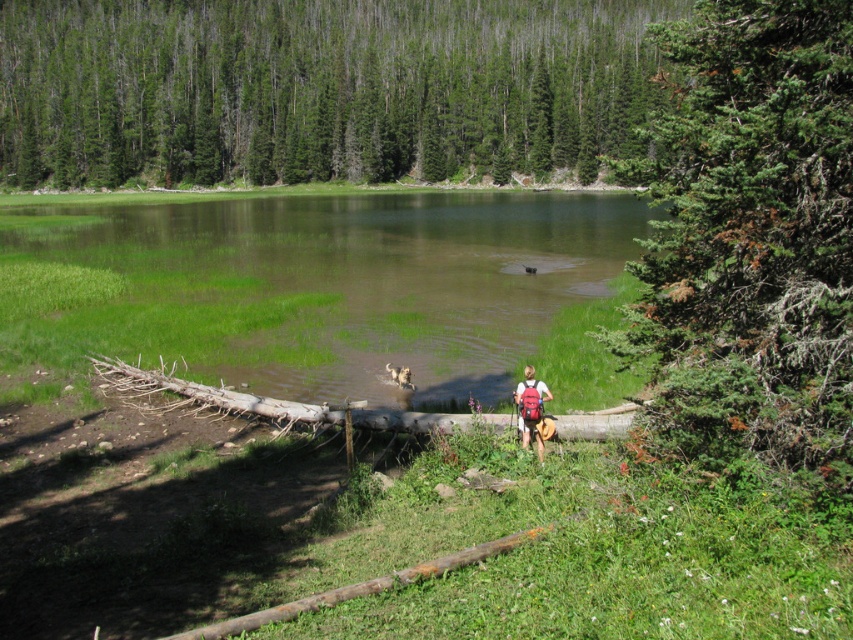
You are standing at the edge of the lake and want to take a photo of the green fir tree at right and the matte red backpack at center. Which object should you focus on first to ensure both are in the frame?

The green fir tree at right is positioned over the matte red backpack at center, so you should focus on the green fir tree at right first to ensure both are visible in the frame.

You are planning to set up a tent between the green fir tree at right and the matte red backpack at center. The tent requires a minimum distance of 50 feet between its two anchor points. Can the space between them accommodate the tent?

The green fir tree at right is 72.72 feet from the matte red backpack at center, which exceeds the 50 feet requirement. Therefore, the space between them can accommodate the tent.